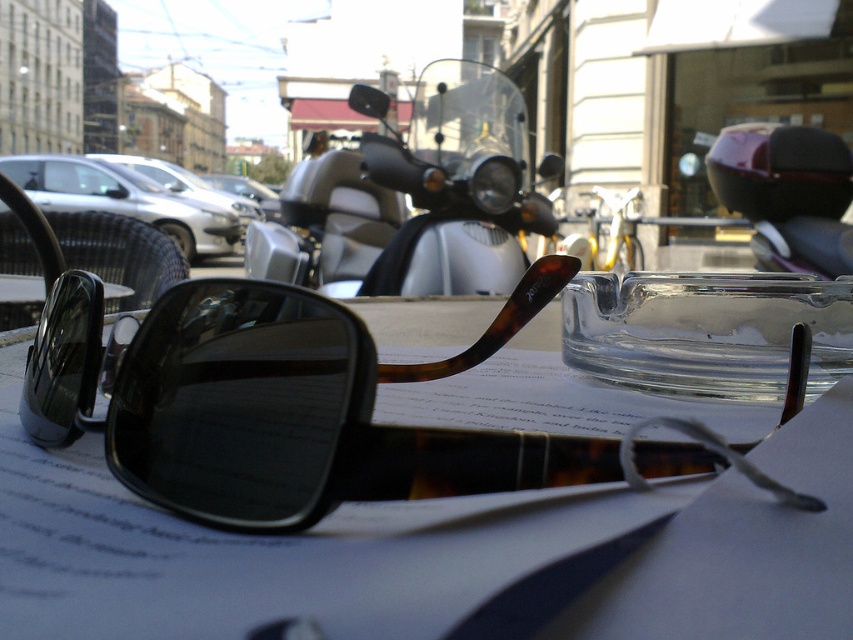
You are a customer at the outdoor table and want to place your phone on the table without covering the tortoiseshell sunglasses at center. Where should you place your phone?

The tortoiseshell sunglasses at center is located at point (291, 412). To avoid covering them, place your phone in an area of the table not occupied by their coordinates.

You are a delivery person who needs to place a small package between the metallic silver scooter at center and the transparent glass ashtray at center on the table. Can the package fit in the space between them?

The metallic silver scooter at center and transparent glass ashtray at center are 11.37 inches apart. Since the package is small, it should fit comfortably in the space between them.